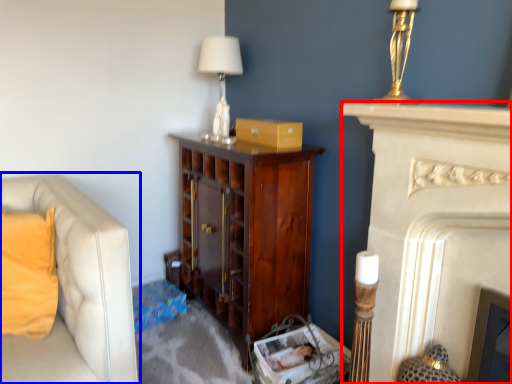
Question: Which of the following is the closest to the observer, fireplace (highlighted by a red box) or studio couch (highlighted by a blue box)?

Choices:
 (A) fireplace
 (B) studio couch

Answer: (A)